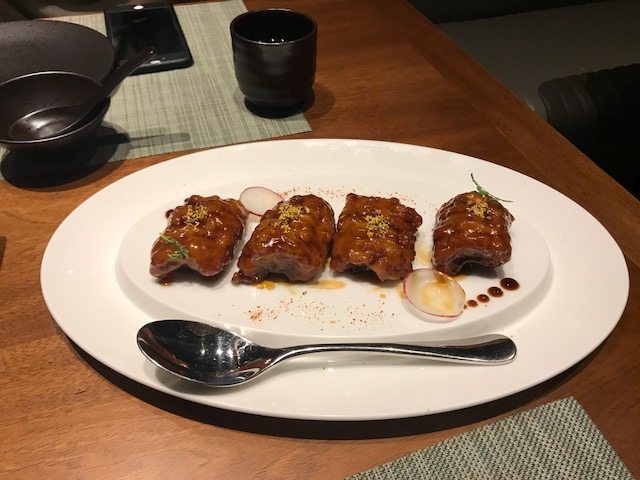
Locate an element on the screen. This screenshot has width=640, height=480. black cup is located at coordinates (278, 56).